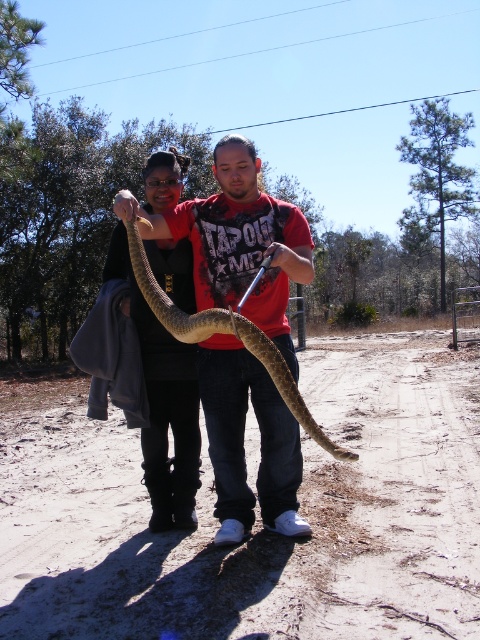
You are a photographer trying to capture a closeup of the snake. You have two points marked in the image to focus on. Which point, point 1 at coordinates point (372, 561) or point 2 at coordinates point (143, 269), is closer to your camera lens?

Point 1 at coordinates point (372, 561) is closer to the camera lens than point 2 at coordinates point (143, 269).

You are a hiker who just arrived at the dirt track at lower center and wants to reach the brown scaly snake at center. Which direction should you move to get closer to the snake?

The dirt track at lower center is closer to the viewer than the brown scaly snake at center, so you should move forward away from the dirt track at lower center towards the brown scaly snake at center to get closer.

You are a hiker who just arrived at the dirt track at lower center and wants to reach the end of the brown scaly snake at center. How much distance do you need to cover?

The dirt track at lower center is shorter than the brown scaly snake at center, so you need to cover the length of the snake which is longer than the track.